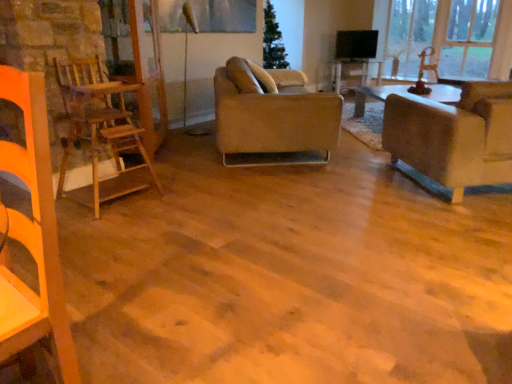
Measure the distance between transparent glass window at upper right and camera.

transparent glass window at upper right is 16.39 feet away from camera.

Identify the location of metallic glass window screen at upper center. The image size is (512, 384). [x=225, y=15].

The width and height of the screenshot is (512, 384). Describe the element at coordinates (225, 15) in the screenshot. I see `metallic glass window screen at upper center` at that location.

Identify the location of transparent wood glass door at left. (147, 74).

This screenshot has height=384, width=512. Describe the element at coordinates (361, 74) in the screenshot. I see `wooden table at center` at that location.

Where is `matte beige couch at right, the 1th studio couch viewed from the right`? This screenshot has height=384, width=512. matte beige couch at right, the 1th studio couch viewed from the right is located at coordinates click(454, 136).

Identify the location of transparent glass window at upper right. The width and height of the screenshot is (512, 384). (445, 37).

Can you confirm if transparent glass window at upper right is wider than leather couch at center, which appears as the 2th studio couch when viewed from the right?

No, transparent glass window at upper right is not wider than leather couch at center, which appears as the 2th studio couch when viewed from the right.

How many degrees apart are the facing directions of transparent glass window at upper right and leather couch at center, which appears as the 2th studio couch when viewed from the right?

138 degrees.

Considering the sizes of objects transparent glass window at upper right and leather couch at center, the 1th studio couch from the left, in the image provided, who is shorter, transparent glass window at upper right or leather couch at center, the 1th studio couch from the left,?

Standing shorter between the two is leather couch at center, the 1th studio couch from the left.

Is point (470, 11) closer to viewer compared to point (269, 95)?

No, (470, 11) is behind (269, 95).

Is metallic glass window screen at upper center thinner than transparent wood glass door at left?

Yes.

From the image's perspective, is metallic glass window screen at upper center located above or below transparent wood glass door at left?

metallic glass window screen at upper center is above transparent wood glass door at left.

Is metallic glass window screen at upper center beside transparent wood glass door at left?

They are not placed beside each other.

Would you consider leather couch at center, which appears as the 2th studio couch when viewed from the right, to be distant from wooden table at center?

leather couch at center, which appears as the 2th studio couch when viewed from the right, is far away from wooden table at center.

Is wooden table at center at the back of leather couch at center, the 1th studio couch from the left?

No.

Looking at this image, which object is positioned more to the left, leather couch at center, which appears as the 2th studio couch when viewed from the right, or wooden table at center?

leather couch at center, which appears as the 2th studio couch when viewed from the right.

Does point (252, 88) lie behind point (338, 90)?

No, (252, 88) is closer to viewer.

Find the location of a particular element. chair in front of the matte beige couch at right, the 1th studio couch viewed from the right is located at coordinates (99, 126).

How many degrees apart are the facing directions of matte beige couch at right, the second studio couch when ordered from left to right, and wooden ladder at left?

The angular difference between matte beige couch at right, the second studio couch when ordered from left to right, and wooden ladder at left is 140 degrees.

Is matte beige couch at right, the second studio couch when ordered from left to right, positioned before wooden ladder at left?

No, it is not.

Does matte beige couch at right, the second studio couch when ordered from left to right, have a greater height compared to wooden ladder at left?

Incorrect, the height of matte beige couch at right, the second studio couch when ordered from left to right, is not larger of that of wooden ladder at left.

Between matte beige couch at right, the 1th studio couch viewed from the right, and leather couch at center, the 1th studio couch from the left, which one has more height?

leather couch at center, the 1th studio couch from the left.

Looking at this image, does matte beige couch at right, the 1th studio couch viewed from the right, have a lesser width compared to leather couch at center, which appears as the 2th studio couch when viewed from the right?

No, matte beige couch at right, the 1th studio couch viewed from the right, is not thinner than leather couch at center, which appears as the 2th studio couch when viewed from the right.

Between point (502, 176) and point (229, 113), which one is positioned behind?

Point (229, 113)

Is the surface of matte beige couch at right, the 1th studio couch viewed from the right, in direct contact with leather couch at center, the 1th studio couch from the left?

No, matte beige couch at right, the 1th studio couch viewed from the right, is not in contact with leather couch at center, the 1th studio couch from the left.

From the image's perspective, relative to transparent wood glass door at left, is transparent glass window at upper right above or below?

From the image's perspective, transparent glass window at upper right appears above transparent wood glass door at left.

Is transparent glass window at upper right in front of or behind transparent wood glass door at left in the image?

Visually, transparent glass window at upper right is located behind transparent wood glass door at left.

Can we say transparent glass window at upper right lies outside transparent wood glass door at left?

transparent glass window at upper right lies outside transparent wood glass door at left's area.

Looking at the image, does transparent glass window at upper right seem bigger or smaller compared to transparent wood glass door at left?

In the image, transparent glass window at upper right appears to be smaller than transparent wood glass door at left.

Does wooden ladder at left lie in front of matte beige couch at right, the second studio couch when ordered from left to right?

Yes, it is in front of matte beige couch at right, the second studio couch when ordered from left to right.

From the image's perspective, is wooden ladder at left above matte beige couch at right, the 1th studio couch viewed from the right?

No, from the image's perspective, wooden ladder at left is not on top of matte beige couch at right, the 1th studio couch viewed from the right.

Does point (117, 99) appear closer or farther from the camera than point (494, 123)?

Clearly, point (117, 99) is more distant from the camera than point (494, 123).

Is wooden ladder at left beside matte beige couch at right, the 1th studio couch viewed from the right?

wooden ladder at left and matte beige couch at right, the 1th studio couch viewed from the right, are not in contact.

Where is `the 1st studio couch below the transparent glass window at upper right (from the image's perspective)`? The height and width of the screenshot is (384, 512). the 1st studio couch below the transparent glass window at upper right (from the image's perspective) is located at coordinates (271, 119).

Find the location of a particular element. glass door in front of the metallic glass window screen at upper center is located at coordinates (147, 74).

Which object lies further to the anchor point matte beige couch at right, the second studio couch when ordered from left to right, wooden ladder at left or leather couch at center, the 1th studio couch from the left?

Answer: wooden ladder at left is further to matte beige couch at right, the second studio couch when ordered from left to right.

Considering their positions, is transparent wood glass door at left positioned closer to wooden table at center than matte beige couch at right, the 1th studio couch viewed from the right?

The object closer to wooden table at center is matte beige couch at right, the 1th studio couch viewed from the right.

Which object lies further to the anchor point matte beige couch at right, the 1th studio couch viewed from the right, leather couch at center, the 1th studio couch from the left, or transparent wood glass door at left?

transparent wood glass door at left.

Estimate the real-world distances between objects in this image. Which object is closer to wooden ladder at left, transparent wood glass door at left or matte beige couch at right, the 1th studio couch viewed from the right?

The object closer to wooden ladder at left is transparent wood glass door at left.

Based on their spatial positions, is metallic glass window screen at upper center or leather couch at center, the 1th studio couch from the left, closer to transparent wood glass door at left?

leather couch at center, the 1th studio couch from the left, is positioned closer to the anchor transparent wood glass door at left.

When comparing their distances from transparent wood glass door at left, does transparent glass window at upper right or metallic glass window screen at upper center seem further?

transparent glass window at upper right is further to transparent wood glass door at left.

Estimate the real-world distances between objects in this image. Which object is further from transparent wood glass door at left, wooden ladder at left or transparent glass window at upper right?

transparent glass window at upper right lies further to transparent wood glass door at left than the other object.

Which object lies nearer to the anchor point wooden ladder at left, wooden table at center or metallic glass window screen at upper center?

The object closer to wooden ladder at left is metallic glass window screen at upper center.

Identify the location of chair between transparent wood glass door at left and transparent glass window at upper right. This screenshot has width=512, height=384. (99, 126).

The image size is (512, 384). I want to click on table located between transparent wood glass door at left and transparent glass window at upper right in the left-right direction, so click(361, 74).

I want to click on window screen between transparent wood glass door at left and wooden table at center in the front-back direction, so click(225, 15).

Locate an element on the screen. The width and height of the screenshot is (512, 384). glass door located between matte beige couch at right, the second studio couch when ordered from left to right, and wooden table at center in the depth direction is located at coordinates (147, 74).